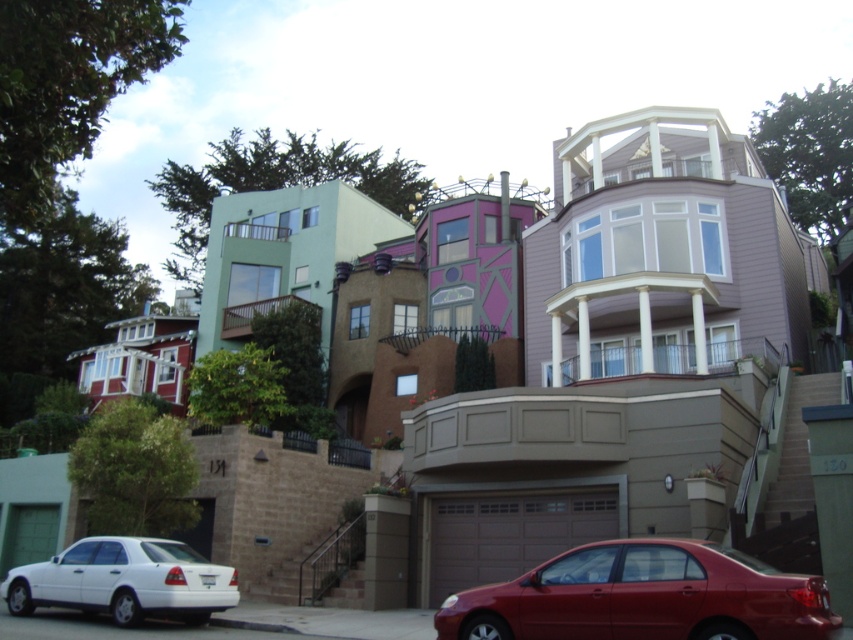
Question: Which point is closer to the camera?

Choices:
 (A) matte white sedan at lower left
 (B) shiny red sedan at lower center

Answer: (B)

Question: Is shiny red sedan at lower center to the left of matte white sedan at lower left from the viewer's perspective?

Choices:
 (A) no
 (B) yes

Answer: (A)

Question: Among these objects, which one is farthest from the camera?

Choices:
 (A) matte white sedan at lower left
 (B) shiny red sedan at lower center

Answer: (A)

Question: Is shiny red sedan at lower center to the right of matte white sedan at lower left from the viewer's perspective?

Choices:
 (A) no
 (B) yes

Answer: (B)

Question: Is shiny red sedan at lower center thinner than matte white sedan at lower left?

Choices:
 (A) no
 (B) yes

Answer: (B)